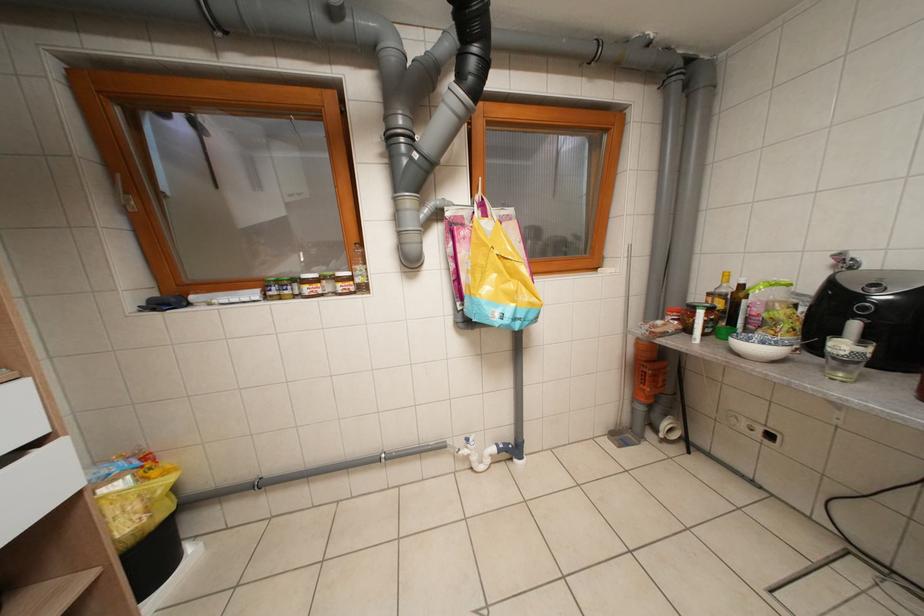
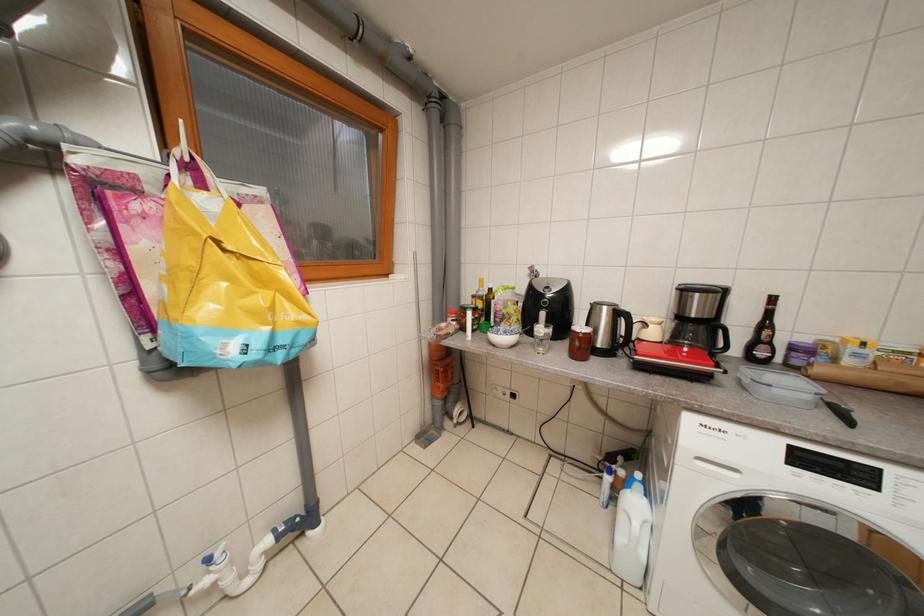
Question: The images are taken continuously from a first-person perspective. In which direction is your viewpoint rotating?

Choices:
 (A) Left
 (B) Right
 (C) Up
 (D) Down

Answer: (B)